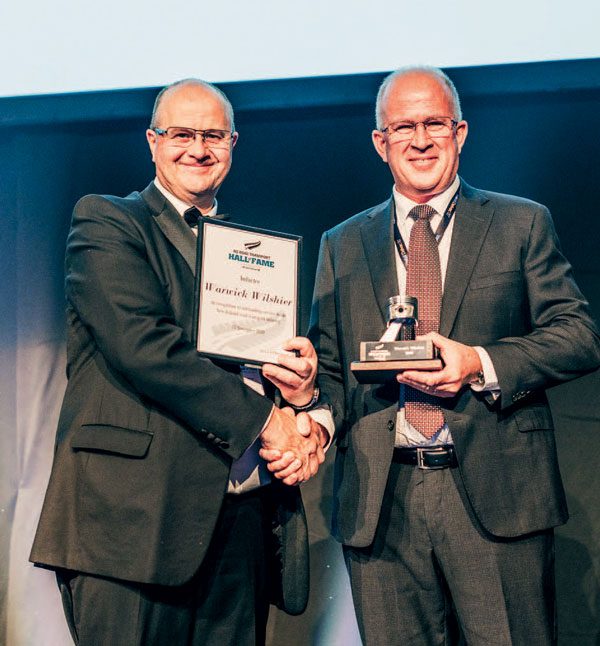
The image size is (600, 646). Identify the location of frame. (274, 295).